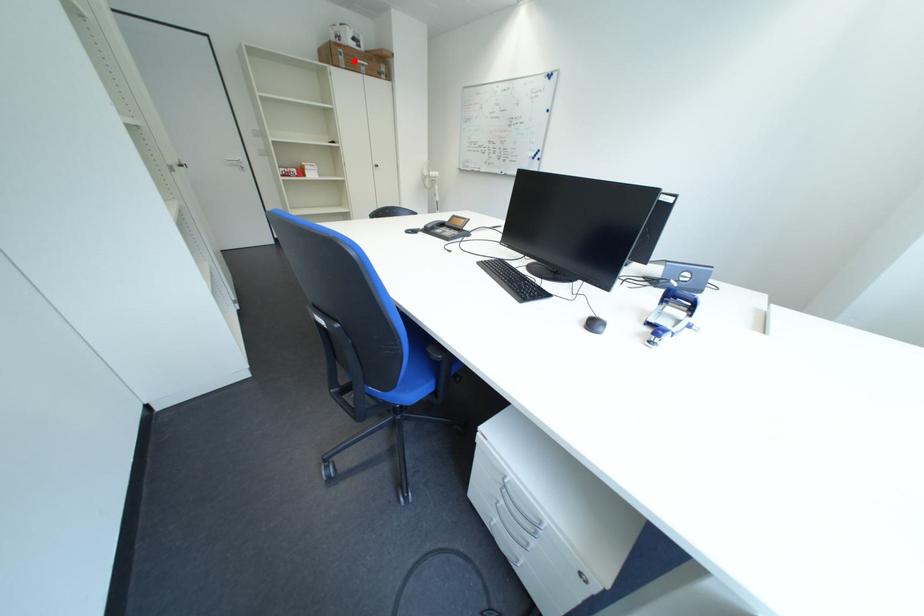
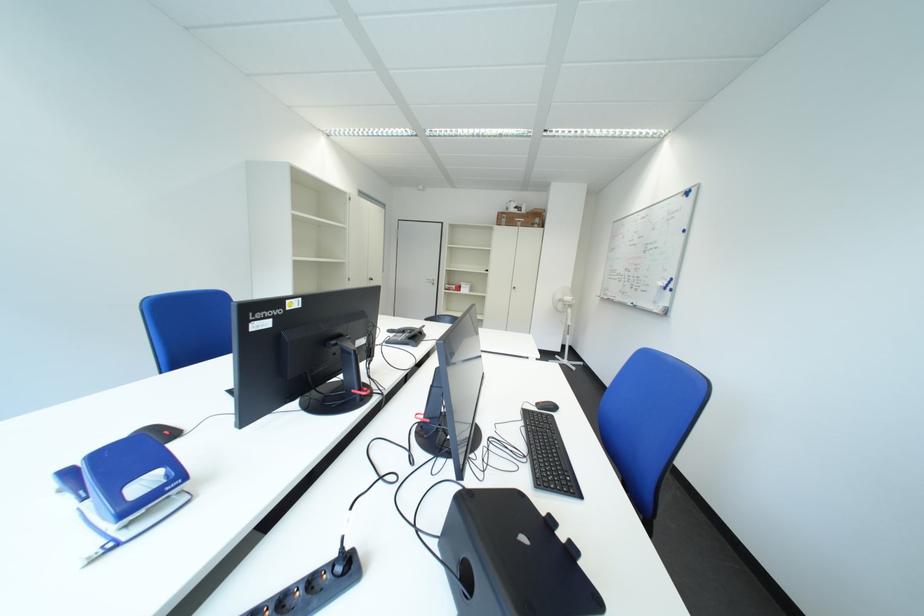
Where in the second image is the point corresponding to the highlighted location from the first image?

(517, 223)